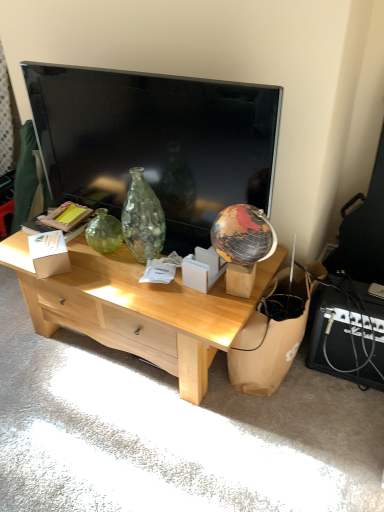
Where is `vacant space underneath white cardboard box at center, marked as the 2th cardboard box in a right-to-left arrangement (from a real-world perspective)`? Image resolution: width=384 pixels, height=512 pixels. vacant space underneath white cardboard box at center, marked as the 2th cardboard box in a right-to-left arrangement (from a real-world perspective) is located at coordinates (66, 263).